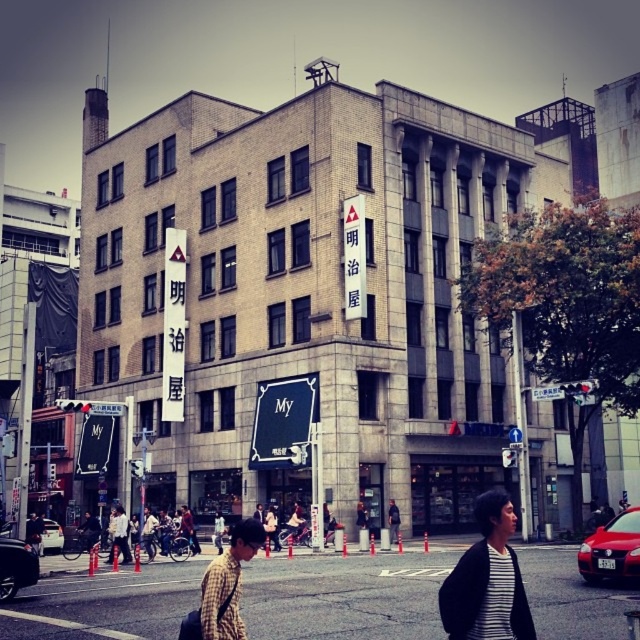
You are standing at the point marked by the coordinates point (x=486, y=580) in the image. What is visible at this location?

The point (x=486, y=580) corresponds to the striped cotton shirt at center.

You are a fashion designer observing two shirts in an urban street scene. You see a striped cotton shirt at center and a plaid fabric shirt at center. Which shirt is located to the right of the other?

The striped cotton shirt at center is positioned on the right side of the plaid fabric shirt at center.